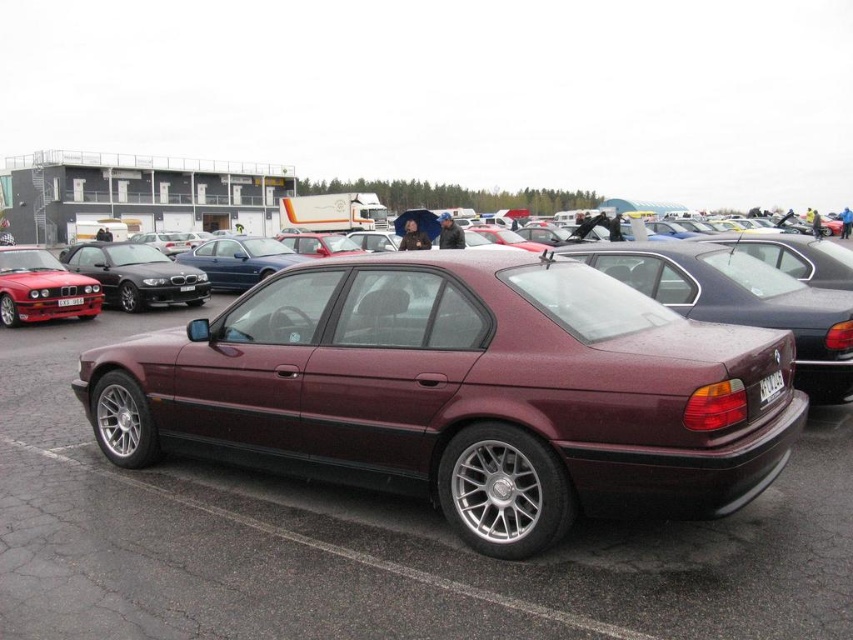
Does satin black car at left appear under matte black sedan at left?

No.

Locate an element on the screen. This screenshot has width=853, height=640. satin black car at left is located at coordinates (136, 275).

The width and height of the screenshot is (853, 640). I want to click on satin black car at left, so click(x=136, y=275).

Does matte black sedan at left have a greater height compared to white plastic license plate at rear?

Yes.

Can you confirm if matte black sedan at left is smaller than white plastic license plate at rear?

Incorrect, matte black sedan at left is not smaller in size than white plastic license plate at rear.

Who is more forward, [102,296] or [766,397]?

Positioned in front is point [766,397].

The image size is (853, 640). In order to click on matte black sedan at left in this screenshot , I will do `click(41, 288)`.

Consider the image. Is maroon metallic sedan at center positioned before matte black sedan at left?

Yes, maroon metallic sedan at center is in front of matte black sedan at left.

Who is taller, maroon metallic sedan at center or matte black sedan at left?

Standing taller between the two is maroon metallic sedan at center.

Who is more distant from viewer, (399, 282) or (25, 244)?

The point (25, 244) is behind.

Locate an element on the screen. maroon metallic sedan at center is located at coordinates (462, 392).